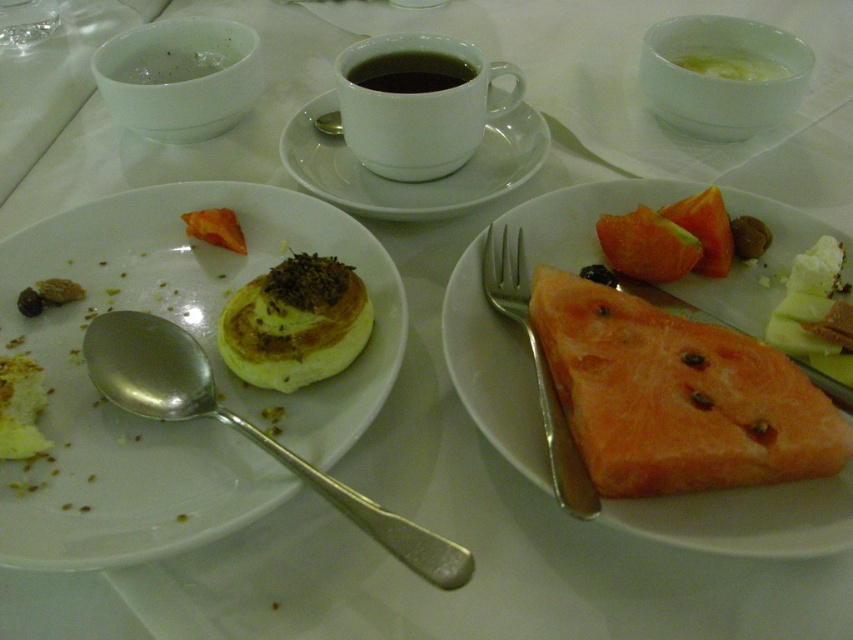
You are setting up a table for a guest and need to place a decorative centerpiece. The table has a coordinate system where the bottom left corner is the origin. The orange fleshed fruit at center is currently at position 0.811 on the x axis and 0.877 on the y axis. Can you move it to the exact center of the table?

The orange fleshed fruit at center is already located at the specified coordinates, which would be the exact center of the table based on the given coordinate system. Therefore, it does not need to be moved.